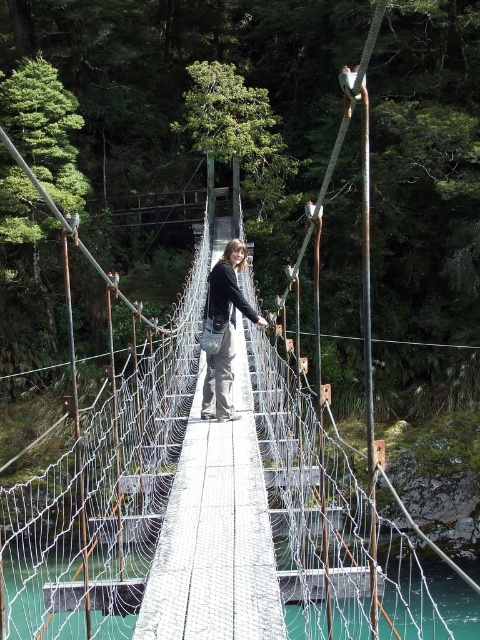
Between matte black jacket at center and teal glassy water at center, which one appears on the left side from the viewer's perspective?

Positioned to the left is matte black jacket at center.

Does matte black jacket at center appear on the right side of teal glassy water at center?

In fact, matte black jacket at center is to the left of teal glassy water at center.

Is point (206, 394) positioned before point (463, 586)?

Yes, point (206, 394) is in front of point (463, 586).

The height and width of the screenshot is (640, 480). In order to click on matte black jacket at center in this screenshot , I will do `click(224, 330)`.